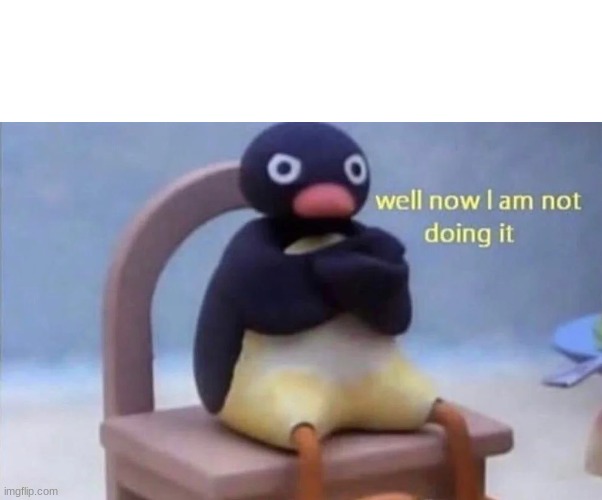
I want to click on chair, so click(134, 298).